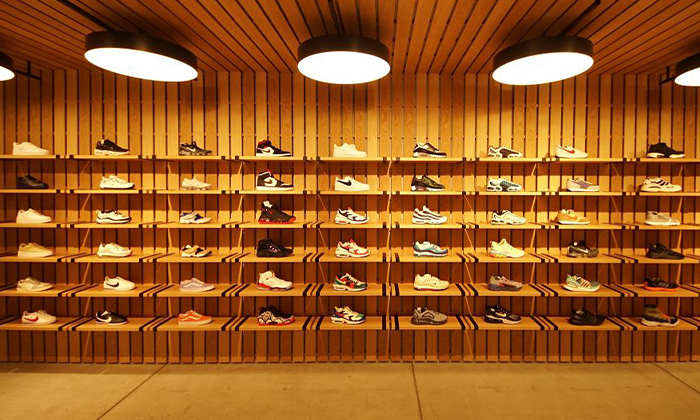
At what (x,y) coordinates should I click in order to perform the action: click on shelves holding shoes. Please return your answer as a coordinate pair (x, y). Image resolution: width=700 pixels, height=420 pixels. Looking at the image, I should click on (153, 158), (148, 190), (150, 224), (152, 256), (153, 289), (147, 323).